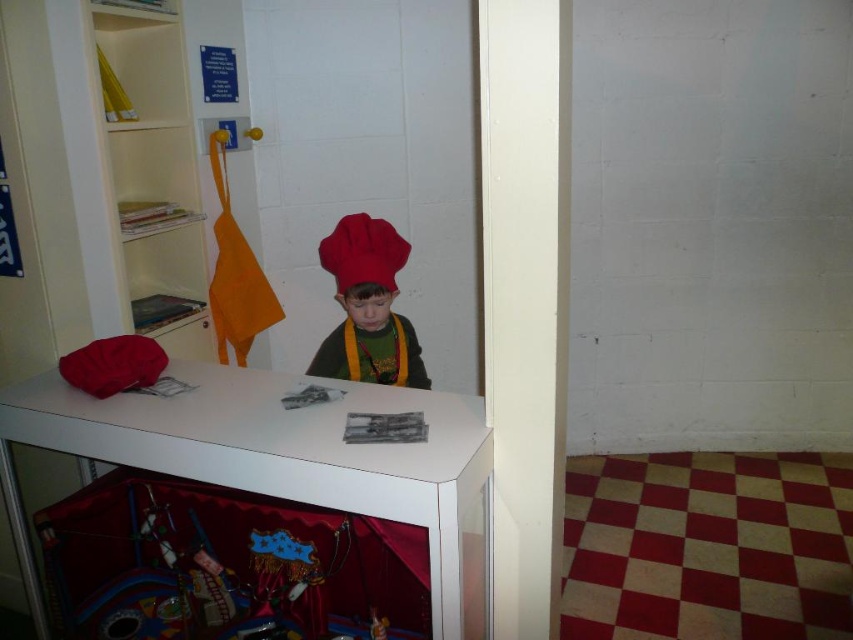
Question: Is white glossy bookshelf at upper left closer to the viewer compared to matte red chef hat at center?

Choices:
 (A) no
 (B) yes

Answer: (B)

Question: Is white glossy bookshelf at upper left behind matte red chef hat at center?

Choices:
 (A) no
 (B) yes

Answer: (A)

Question: Does white glossy bookshelf at upper left come behind matte red chef hat at center?

Choices:
 (A) yes
 (B) no

Answer: (B)

Question: Which of the following is the closest to the observer?

Choices:
 (A) matte red chef hat at center
 (B) white glossy bookshelf at upper left

Answer: (B)

Question: Which object appears closest to the camera in this image?

Choices:
 (A) matte red chef hat at center
 (B) white glossy bookshelf at upper left

Answer: (B)